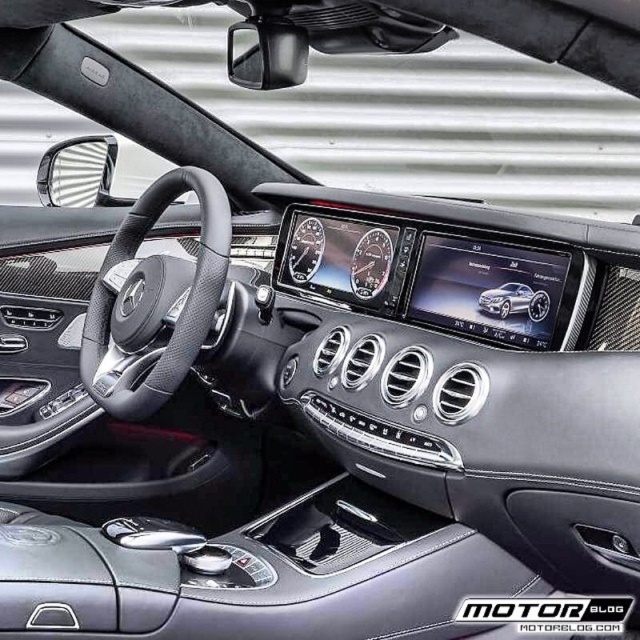
Is black leather steering wheel at center thinner than satin silver metallic car at center?

Incorrect, black leather steering wheel at center's width is not less than satin silver metallic car at center's.

Can you confirm if black leather steering wheel at center is shorter than satin silver metallic car at center?

Incorrect, black leather steering wheel at center's height does not fall short of satin silver metallic car at center's.

Where is `black leather steering wheel at center`? black leather steering wheel at center is located at coordinates (154, 300).